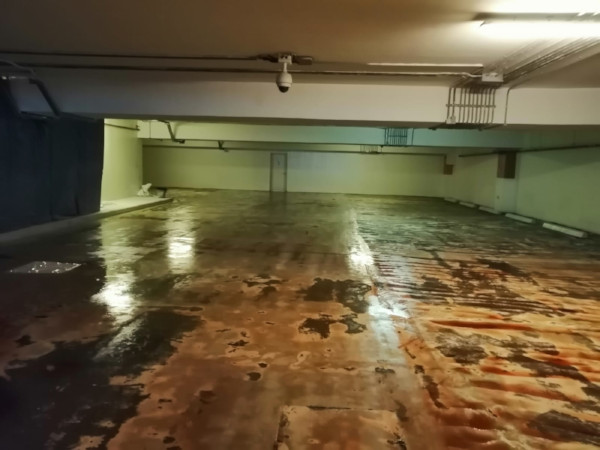
Locate an element on the screen. beige ceiling is located at coordinates (305, 35).